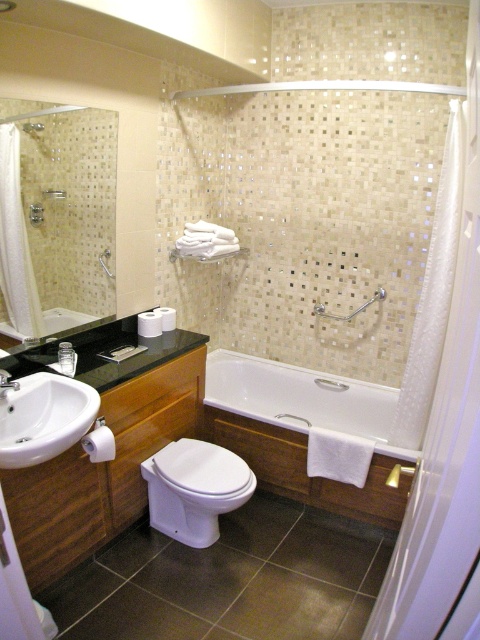
Does white glossy bathtub at center have a smaller size compared to brushed metal faucet at sink left?

Incorrect, white glossy bathtub at center is not smaller in size than brushed metal faucet at sink left.

Is white glossy bathtub at center wider than brushed metal faucet at sink left?

Yes, white glossy bathtub at center is wider than brushed metal faucet at sink left.

Is point (393, 413) behind point (4, 372)?

Yes.

You are a GUI agent. You are given a task and a screenshot of the screen. Output one action in this format:
    pyautogui.click(x=<x>, y=<y>)
    Task: Click on the white glossy bathtub at center
    
    Given the screenshot: What is the action you would take?
    pyautogui.click(x=301, y=397)

Who is shorter, wooden vanity at center or matte silver shower at upper center?

matte silver shower at upper center

Where is `wooden vanity at center`? wooden vanity at center is located at coordinates (116, 449).

Where is `wooden vanity at center`? Image resolution: width=480 pixels, height=640 pixels. wooden vanity at center is located at coordinates (116, 449).

Does white translucent screen door at right appear on the left side of wooden vanity at center?

No, white translucent screen door at right is not to the left of wooden vanity at center.

Between white translucent screen door at right and wooden vanity at center, which one is positioned higher?

white translucent screen door at right is above.

Is point (478, 429) farther from viewer compared to point (44, 579)?

That is False.

You are a GUI agent. You are given a task and a screenshot of the screen. Output one action in this format:
    pyautogui.click(x=<x>, y=<y>)
    Task: Click on the white translucent screen door at right
    The image size is (480, 640).
    Given the screenshot: What is the action you would take?
    [445, 445]